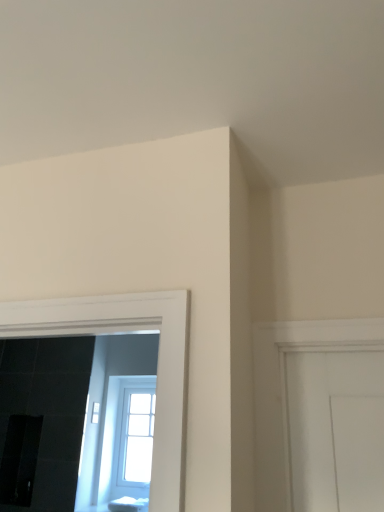
Question: Does clear glass window at center have a greater height compared to white glossy sugar cube at lower center?

Choices:
 (A) no
 (B) yes

Answer: (B)

Question: Is clear glass window at center to the left of white glossy sugar cube at lower center from the viewer's perspective?

Choices:
 (A) yes
 (B) no

Answer: (A)

Question: From a real-world perspective, is clear glass window at center beneath white glossy sugar cube at lower center?

Choices:
 (A) yes
 (B) no

Answer: (B)

Question: Are clear glass window at center and white glossy sugar cube at lower center located far from each other?

Choices:
 (A) no
 (B) yes

Answer: (A)

Question: Is clear glass window at center completely or partially outside of white glossy sugar cube at lower center?

Choices:
 (A) yes
 (B) no

Answer: (A)

Question: Is clear glass window at center next to white glossy sugar cube at lower center and touching it?

Choices:
 (A) no
 (B) yes

Answer: (A)

Question: Considering the relative positions of white glossy sugar cube at lower center and clear glass window at center in the image provided, is white glossy sugar cube at lower center to the left of clear glass window at center from the viewer's perspective?

Choices:
 (A) no
 (B) yes

Answer: (A)

Question: Is white glossy sugar cube at lower center taller than clear glass window at center?

Choices:
 (A) yes
 (B) no

Answer: (B)

Question: Is white glossy sugar cube at lower center thinner than clear glass window at center?

Choices:
 (A) yes
 (B) no

Answer: (B)

Question: Does white glossy sugar cube at lower center lie in front of clear glass window at center?

Choices:
 (A) yes
 (B) no

Answer: (A)

Question: Is clear glass window at center at the back of white glossy sugar cube at lower center?

Choices:
 (A) yes
 (B) no

Answer: (B)

Question: Considering the relative sizes of white glossy sugar cube at lower center and clear glass window at center in the image provided, is white glossy sugar cube at lower center wider than clear glass window at center?

Choices:
 (A) yes
 (B) no

Answer: (A)

Question: Is clear glass window at center in front of or behind white glossy sugar cube at lower center in the image?

Choices:
 (A) behind
 (B) front

Answer: (A)